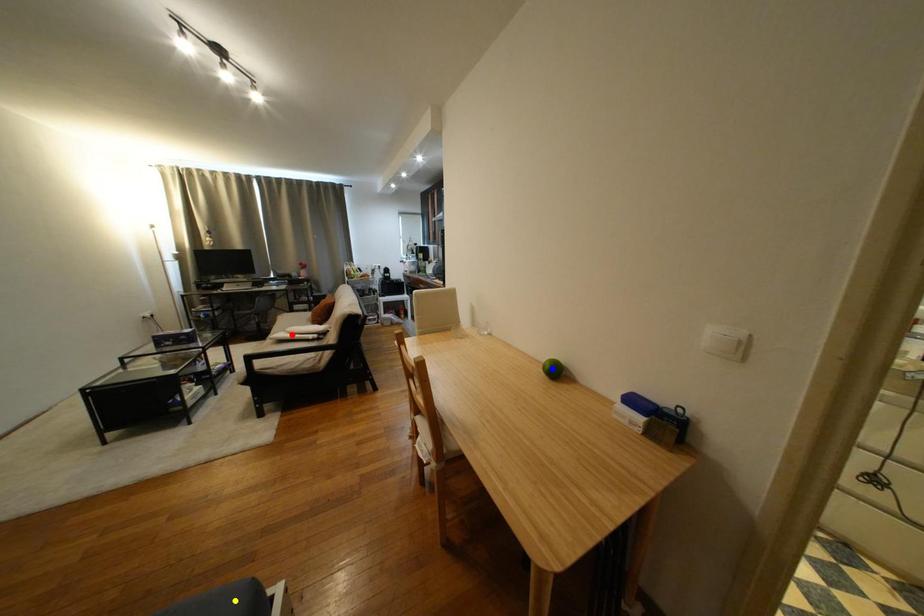
Order these from nearest to farthest:
blue point | red point | yellow point

yellow point → blue point → red point